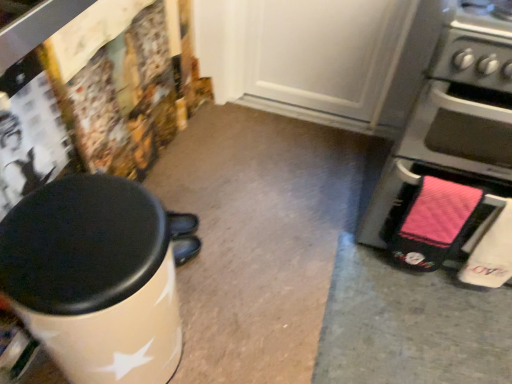
Identify the location of pink fabric oven at right. Image resolution: width=512 pixels, height=384 pixels. (454, 120).

This screenshot has height=384, width=512. Describe the element at coordinates (454, 120) in the screenshot. I see `pink fabric oven at right` at that location.

Where is `white glossy waste container at left`? white glossy waste container at left is located at coordinates (98, 277).

Describe the element at coordinates (98, 277) in the screenshot. I see `white glossy waste container at left` at that location.

The height and width of the screenshot is (384, 512). What are the coordinates of `pink fabric oven at right` in the screenshot? It's located at pos(454,120).

Is white glossy waste container at left at the right side of pink fabric oven at right?

No.

Which object is further away from the camera taking this photo, white glossy waste container at left or pink fabric oven at right?

pink fabric oven at right is further from the camera.

Which is closer to the camera, (115, 327) or (448, 130)?

Positioned in front is point (115, 327).

From the image's perspective, does white glossy waste container at left appear lower than pink fabric oven at right?

Indeed, from the image's perspective, white glossy waste container at left is shown beneath pink fabric oven at right.

From a real-world perspective, who is located lower, white glossy waste container at left or pink fabric oven at right?

In real-world perspective, white glossy waste container at left is lower.

Which object is wider, white glossy waste container at left or pink fabric oven at right?

With larger width is pink fabric oven at right.

Considering the sizes of white glossy waste container at left and pink fabric oven at right in the image, is white glossy waste container at left taller or shorter than pink fabric oven at right?

Considering their sizes, white glossy waste container at left has less height than pink fabric oven at right.

Who is bigger, white glossy waste container at left or pink fabric oven at right?

pink fabric oven at right is bigger.

Is pink fabric oven at right completely or partially inside white glossy waste container at left?

That's incorrect, pink fabric oven at right is not inside white glossy waste container at left.

Is there a large distance between white glossy waste container at left and pink fabric oven at right?

white glossy waste container at left is near pink fabric oven at right, not far away.

Is white glossy waste container at left aimed at pink fabric oven at right?

No.

How different are the orientations of white glossy waste container at left and pink fabric oven at right in degrees?

The angle between the facing direction of white glossy waste container at left and the facing direction of pink fabric oven at right is 83.5 degrees.

At what (x,y) coordinates should I click in order to perform the action: click on waste container in front of the pink fabric oven at right. Please return your answer as a coordinate pair (x, y). This screenshot has height=384, width=512. Looking at the image, I should click on [x=98, y=277].

Does pink fabric oven at right appear on the right side of white glossy waste container at left?

Yes, pink fabric oven at right is to the right of white glossy waste container at left.

Is the depth of pink fabric oven at right greater than that of white glossy waste container at left?

Yes, it is behind white glossy waste container at left.

Which is more distant, (472, 49) or (100, 357)?

Point (472, 49)

In the scene shown: From the image's perspective, which object appears higher, pink fabric oven at right or white glossy waste container at left?

pink fabric oven at right, from the image's perspective.

From a real-world perspective, who is located higher, pink fabric oven at right or white glossy waste container at left?

From a 3D spatial view, pink fabric oven at right is above.

Considering the relative sizes of pink fabric oven at right and white glossy waste container at left in the image provided, is pink fabric oven at right thinner than white glossy waste container at left?

Incorrect, the width of pink fabric oven at right is not less than that of white glossy waste container at left.

Considering the relative sizes of pink fabric oven at right and white glossy waste container at left in the image provided, is pink fabric oven at right shorter than white glossy waste container at left?

No.

Considering the relative sizes of pink fabric oven at right and white glossy waste container at left in the image provided, is pink fabric oven at right smaller than white glossy waste container at left?

Actually, pink fabric oven at right might be larger than white glossy waste container at left.

Is white glossy waste container at left surrounded by pink fabric oven at right?

No, white glossy waste container at left is not surrounded by pink fabric oven at right.

Are pink fabric oven at right and white glossy waste container at left far apart?

pink fabric oven at right is actually quite close to white glossy waste container at left.

Is pink fabric oven at right oriented towards white glossy waste container at left?

No, pink fabric oven at right does not turn towards white glossy waste container at left.

How different are the orientations of pink fabric oven at right and white glossy waste container at left in degrees?

There is a 83.5-degree angle between the facing directions of pink fabric oven at right and white glossy waste container at left.

Find the location of a particular element. home appliance behind the white glossy waste container at left is located at coordinates (454, 120).

What are the coordinates of `home appliance above the white glossy waste container at left (from a real-world perspective)` in the screenshot? It's located at (454, 120).

In order to click on waste container below the pink fabric oven at right (from the image's perspective) in this screenshot , I will do `click(98, 277)`.